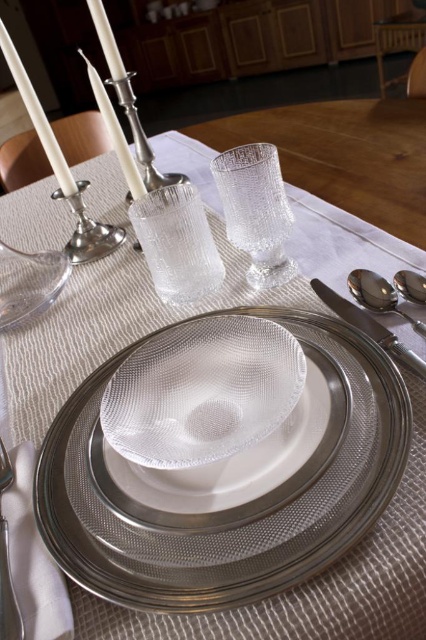
Question: Is clear glass platter at center behind satin silver spoon at lower right?

Choices:
 (A) no
 (B) yes

Answer: (A)

Question: Is clear textured glass at center positioned at the back of satin silver knife at upper right?

Choices:
 (A) no
 (B) yes

Answer: (B)

Question: Estimate the real-world distances between objects in this image. Which object is farther from the satin silver spoon at lower right?

Choices:
 (A) clear glass wine glass at left
 (B) silver metallic fork at lower left

Answer: (A)

Question: Which point appears farthest from the camera in this image?

Choices:
 (A) (32, 275)
 (B) (8, 572)
 (C) (365, 294)

Answer: (A)

Question: Which object is farther from the camera taking this photo?

Choices:
 (A) clear glass bowl at center
 (B) satin silver knife at upper right
 (C) silver metallic candle holder at upper left
 (D) satin silver spoon at upper right

Answer: (C)

Question: Is satin silver knife at upper right further to camera compared to satin silver spoon at upper right?

Choices:
 (A) no
 (B) yes

Answer: (A)